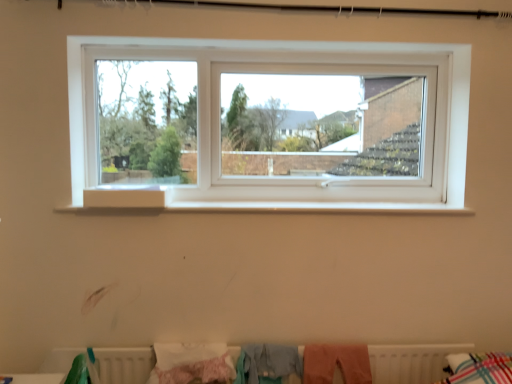
Question: Would you say pink fabric at lower center, which is counted as the 1th clothing, starting from the right, is outside pink fluffy blanket at lower center, the first clothing in the left-to-right sequence?

Choices:
 (A) yes
 (B) no

Answer: (A)

Question: From a real-world perspective, is pink fabric at lower center, which is the 3th clothing from left to right, on top of pink fluffy blanket at lower center, placed as the third clothing when sorted from right to left?

Choices:
 (A) no
 (B) yes

Answer: (A)

Question: Can you confirm if pink fabric at lower center, which is counted as the 1th clothing, starting from the right, is thinner than pink fluffy blanket at lower center, the first clothing in the left-to-right sequence?

Choices:
 (A) no
 (B) yes

Answer: (B)

Question: Is pink fabric at lower center, which is counted as the 1th clothing, starting from the right, facing away from pink fluffy blanket at lower center, the first clothing in the left-to-right sequence?

Choices:
 (A) no
 (B) yes

Answer: (A)

Question: Considering the relative sizes of pink fabric at lower center, which is the 3th clothing from left to right, and pink fluffy blanket at lower center, placed as the third clothing when sorted from right to left, in the image provided, is pink fabric at lower center, which is the 3th clothing from left to right, shorter than pink fluffy blanket at lower center, placed as the third clothing when sorted from right to left,?

Choices:
 (A) yes
 (B) no

Answer: (A)

Question: Would you say pink fluffy blanket at lower center, placed as the third clothing when sorted from right to left, is inside or outside white matte radiator at lower center?

Choices:
 (A) outside
 (B) inside

Answer: (B)

Question: In the image, is pink fluffy blanket at lower center, the first clothing in the left-to-right sequence, positioned in front of or behind white matte radiator at lower center?

Choices:
 (A) front
 (B) behind

Answer: (A)

Question: Considering the positions of pink fluffy blanket at lower center, placed as the third clothing when sorted from right to left, and white matte radiator at lower center in the image, is pink fluffy blanket at lower center, placed as the third clothing when sorted from right to left, wider or thinner than white matte radiator at lower center?

Choices:
 (A) thin
 (B) wide

Answer: (B)

Question: From the image's perspective, is pink fluffy blanket at lower center, the first clothing in the left-to-right sequence, located above or below white matte radiator at lower center?

Choices:
 (A) below
 (B) above

Answer: (B)

Question: Does point (164, 342) appear closer or farther from the camera than point (298, 374)?

Choices:
 (A) farther
 (B) closer

Answer: (A)

Question: From a real-world perspective, is pink fluffy blanket at lower center, placed as the third clothing when sorted from right to left, above or below light blue fabric at lower center, placed as the 2th clothing when sorted from left to right?

Choices:
 (A) above
 (B) below

Answer: (B)

Question: From the image's perspective, is pink fluffy blanket at lower center, the first clothing in the left-to-right sequence, positioned above or below light blue fabric at lower center, placed as the 2th clothing when sorted from left to right?

Choices:
 (A) above
 (B) below

Answer: (B)

Question: Would you say pink fluffy blanket at lower center, placed as the third clothing when sorted from right to left, is inside or outside light blue fabric at lower center, acting as the second clothing starting from the right?

Choices:
 (A) outside
 (B) inside

Answer: (A)

Question: From a real-world perspective, relative to pink fabric at lower center, which is the 3th clothing from left to right, is white matte radiator at lower center vertically above or below?

Choices:
 (A) below
 (B) above

Answer: (A)

Question: Is white matte radiator at lower center spatially inside pink fabric at lower center, which is the 3th clothing from left to right, or outside of it?

Choices:
 (A) outside
 (B) inside

Answer: (A)